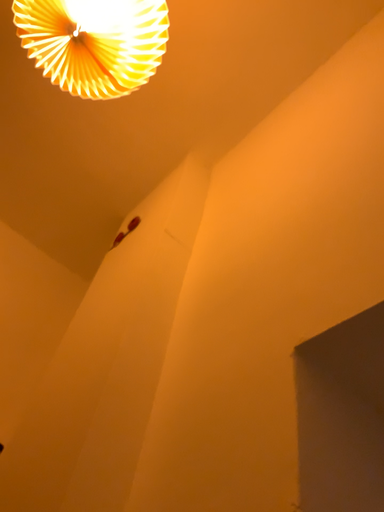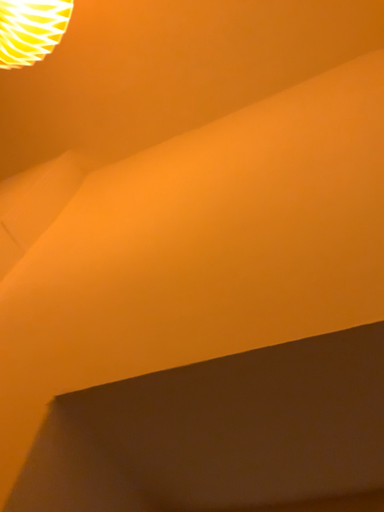
Question: Which way did the camera rotate in the video?

Choices:
 (A) rotated left
 (B) rotated right

Answer: (B)